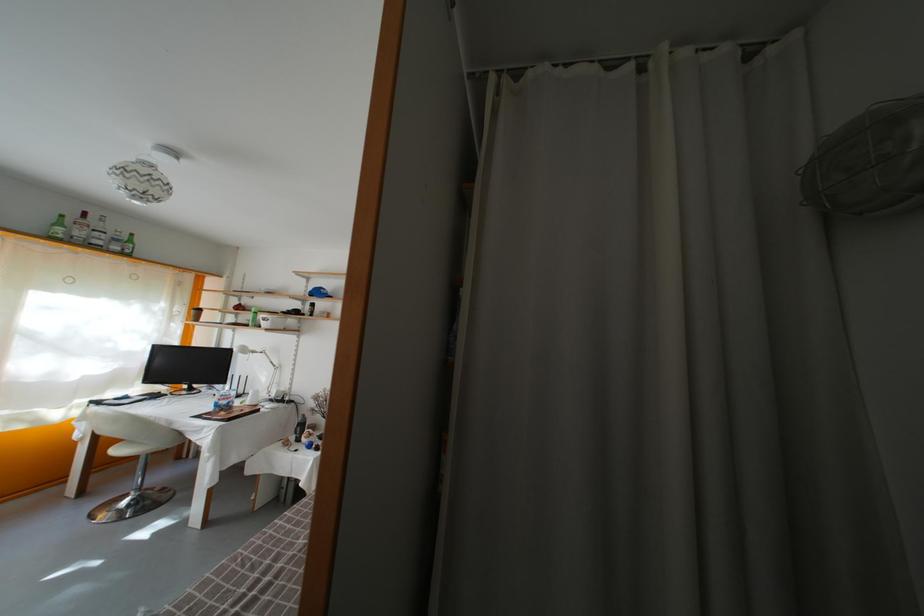
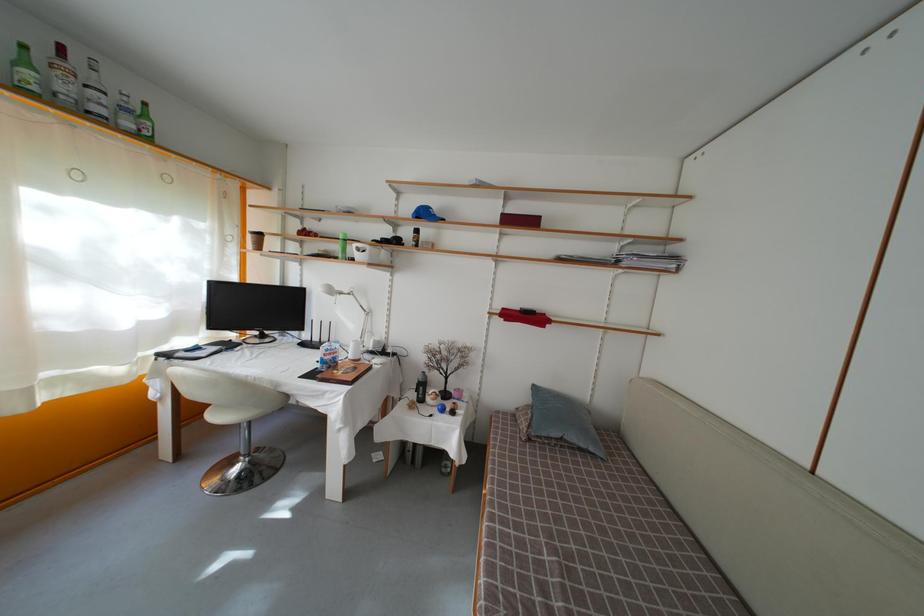
Locate, in the second image, the point that corresponds to the point at 67,230 in the first image.

(31, 69)